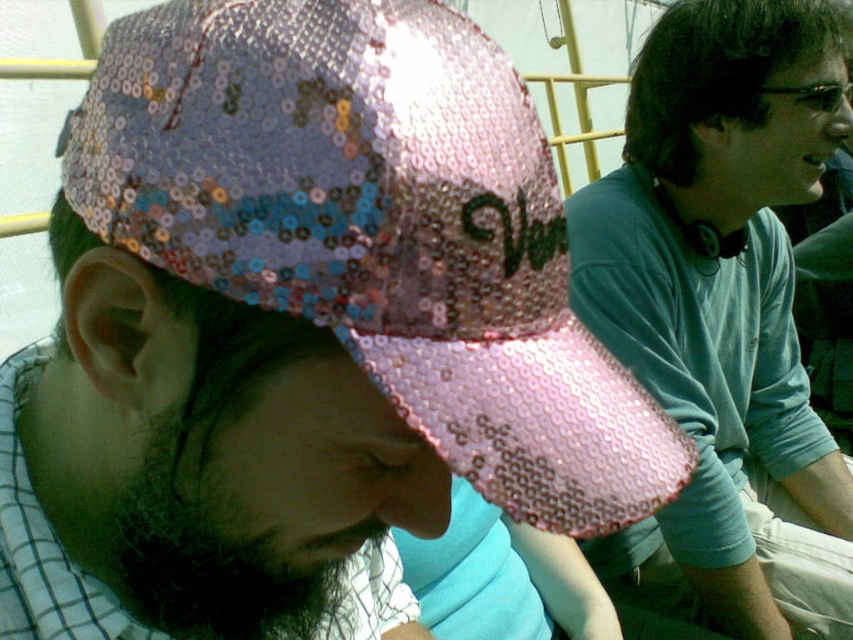
Is pink sequined baseball cap at center above dark brown fuzzy beard at lower left?

Indeed, pink sequined baseball cap at center is positioned over dark brown fuzzy beard at lower left.

Is pink sequined baseball cap at center behind dark brown fuzzy beard at lower left?

No, pink sequined baseball cap at center is closer to the viewer.

Locate an element on the screen. pink sequined baseball cap at center is located at coordinates (376, 228).

Locate an element on the screen. pink sequined baseball cap at center is located at coordinates (376, 228).

Find the location of a particular element. The width and height of the screenshot is (853, 640). pink sequined cap at upper left is located at coordinates (724, 307).

Which of these two, pink sequined cap at upper left or dark brown fuzzy beard at lower left, stands taller?

Standing taller between the two is pink sequined cap at upper left.

The width and height of the screenshot is (853, 640). What do you see at coordinates (724, 307) in the screenshot?
I see `pink sequined cap at upper left` at bounding box center [724, 307].

The height and width of the screenshot is (640, 853). I want to click on pink sequined cap at upper left, so click(x=724, y=307).

Can you confirm if pink sequined baseball cap at center is positioned to the left of pink sequined cap at upper left?

Yes, pink sequined baseball cap at center is to the left of pink sequined cap at upper left.

Does pink sequined baseball cap at center come in front of pink sequined cap at upper left?

Yes, pink sequined baseball cap at center is in front of pink sequined cap at upper left.

You are a GUI agent. You are given a task and a screenshot of the screen. Output one action in this format:
    pyautogui.click(x=<x>, y=<y>)
    Task: Click on the pink sequined baseball cap at center
    This screenshot has height=640, width=853.
    Given the screenshot: What is the action you would take?
    pyautogui.click(x=376, y=228)